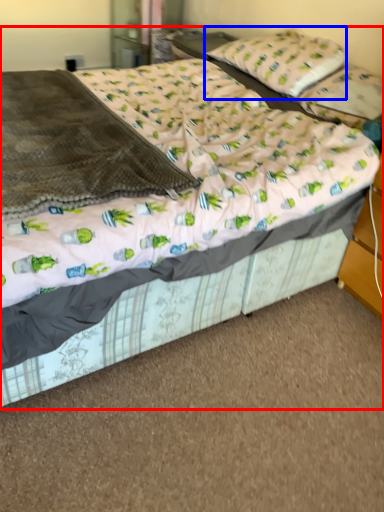
Question: Which of the following is the closest to the observer, bed (highlighted by a red box) or pillow (highlighted by a blue box)?

Choices:
 (A) bed
 (B) pillow

Answer: (A)